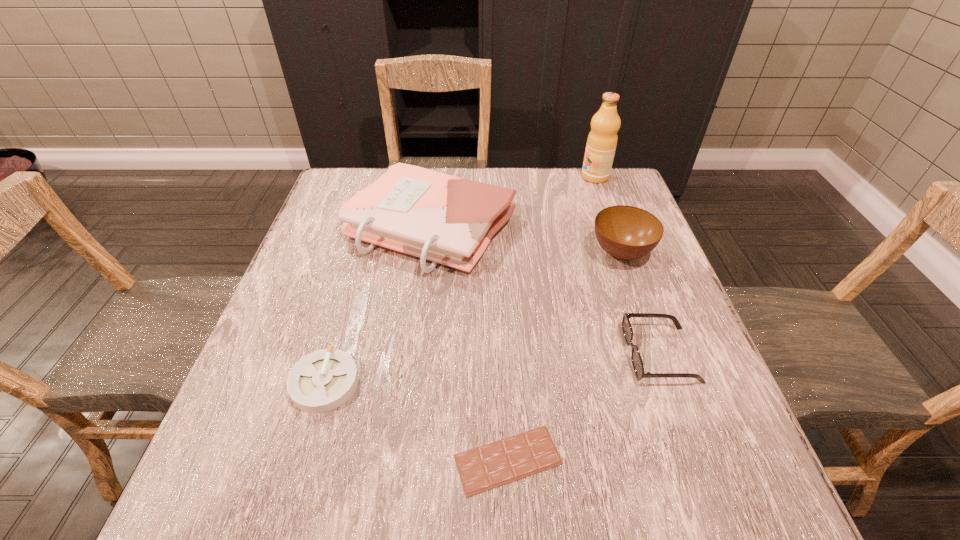
Identify the location of object positioned at the near edge. Image resolution: width=960 pixels, height=540 pixels. (495, 464).

Where is `phonebook at the left edge`? The image size is (960, 540). phonebook at the left edge is located at coordinates (445, 219).

In order to click on ashtray situated at the left edge in this screenshot , I will do `click(323, 380)`.

The width and height of the screenshot is (960, 540). Find the location of `fruit juice present at the right edge`. fruit juice present at the right edge is located at coordinates [x=602, y=140].

Find the location of a particular element. The width and height of the screenshot is (960, 540). bowl that is at the right edge is located at coordinates (625, 232).

This screenshot has height=540, width=960. Find the location of `sunglasses that is at the right edge`. sunglasses that is at the right edge is located at coordinates (636, 359).

Find the location of a particular element. The image size is (960, 540). object at the far left corner is located at coordinates (445, 219).

Locate an element on the screen. object located at the far right corner is located at coordinates (602, 140).

The height and width of the screenshot is (540, 960). I want to click on vacant region at the far edge of the desktop, so click(x=547, y=182).

Find the location of a particular element. The height and width of the screenshot is (540, 960). vacant space at the near edge is located at coordinates (591, 470).